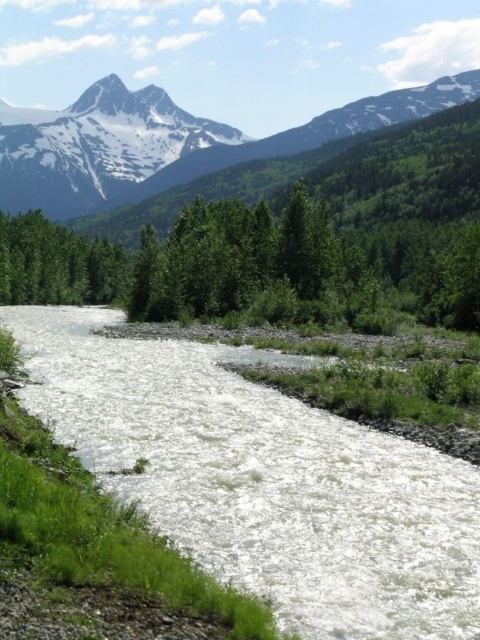
You are a hiker planning to cross the river using a narrow wooden bridge. You see the white frothy water at center and the snowy granite mountain at upper left. Which object is wider from your viewpoint?

The white frothy water at center is narrower than the snowy granite mountain at upper left, so the snowy granite mountain at upper left is wider from your viewpoint.

You are a photographer standing at the riverbank. You want to take a photo that includes both point (359,538) and point (188,136). Which point should you focus on first to ensure both are in sharp focus?

You should focus on point (359,538) first because it is closer to the camera than point (188,136). This ensures the closer point is in focus, and the farther point may also be within the depth of field.